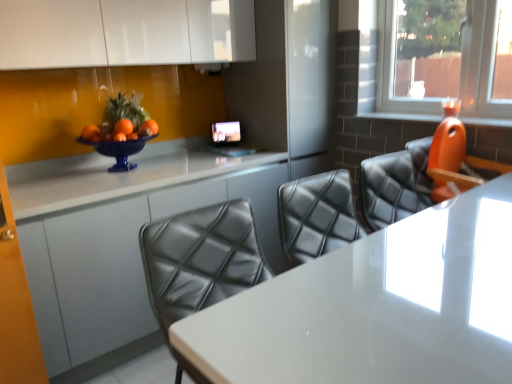
Where is `free point above white glossy counter at center (from a real-world perspective)`? This screenshot has height=384, width=512. free point above white glossy counter at center (from a real-world perspective) is located at coordinates (133, 168).